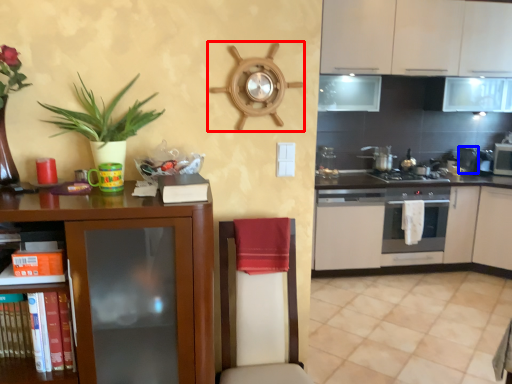
Question: Which point is further to the camera, appliance (highlighted by a red box) or appliance (highlighted by a blue box)?

Choices:
 (A) appliance
 (B) appliance

Answer: (B)